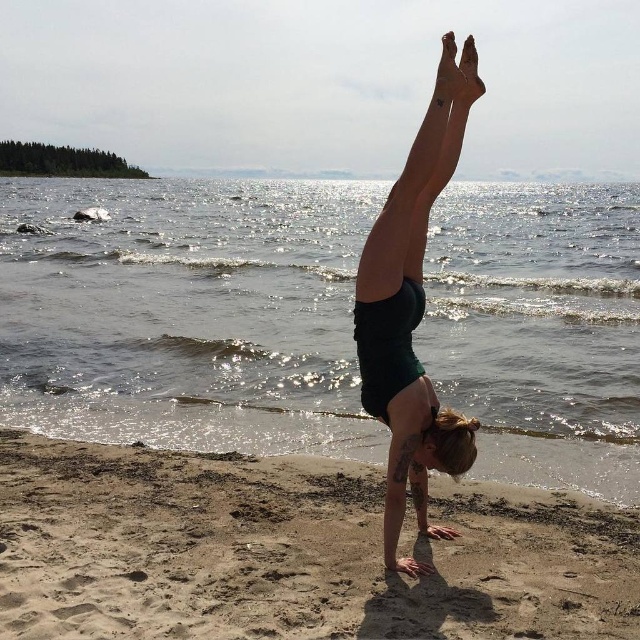
Question: Where is glistening water at center located in relation to brown sandy beach at lower center in the image?

Choices:
 (A) above
 (B) below

Answer: (A)

Question: Based on their relative distances, which object is farther from the brown sandy beach at lower center?

Choices:
 (A) glistening water at center
 (B) green matte shorts at center

Answer: (A)

Question: Which of the following is the closest to the observer?

Choices:
 (A) (416, 568)
 (B) (173, 246)

Answer: (A)

Question: Is glistening water at center bigger than green matte shorts at center?

Choices:
 (A) yes
 (B) no

Answer: (A)

Question: Is glistening water at center to the left of brown sandy beach at lower center from the viewer's perspective?

Choices:
 (A) no
 (B) yes

Answer: (A)

Question: Estimate the real-world distances between objects in this image. Which object is closer to the green matte shorts at center?

Choices:
 (A) brown sandy beach at lower center
 (B) glistening water at center

Answer: (A)